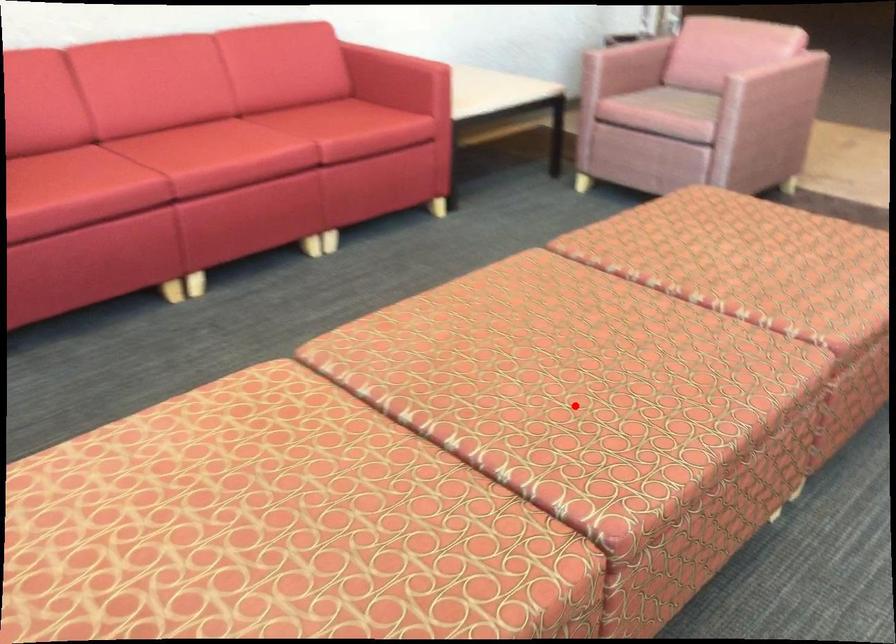
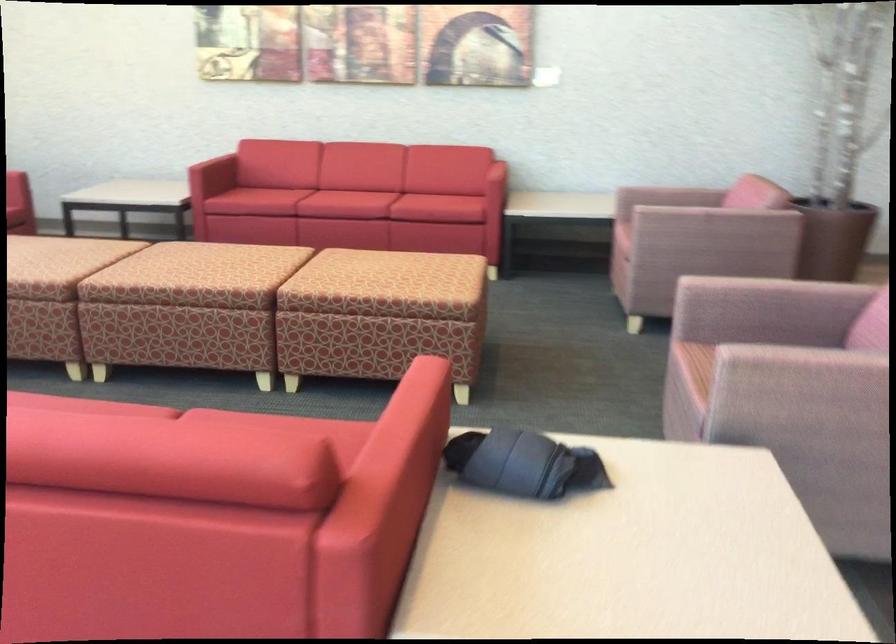
Question: A red point is marked in image1. In image2, is the corresponding 3D point closer to the camera or farther? Reply with the corresponding letter.

Choices:
 (A) The corresponding 3D point is closer.
 (B) The corresponding 3D point is farther.

Answer: (B)